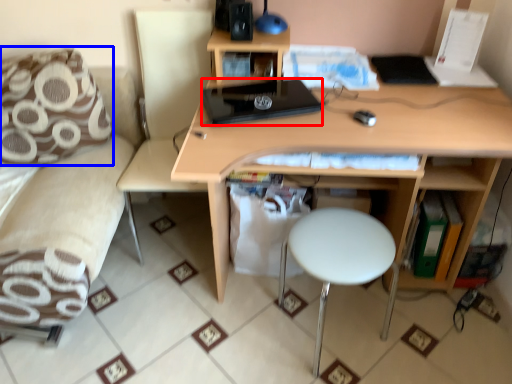
Question: Which of the following is the closest to the observer, laptop (highlighted by a red box) or pillow (highlighted by a blue box)?

Choices:
 (A) laptop
 (B) pillow

Answer: (A)